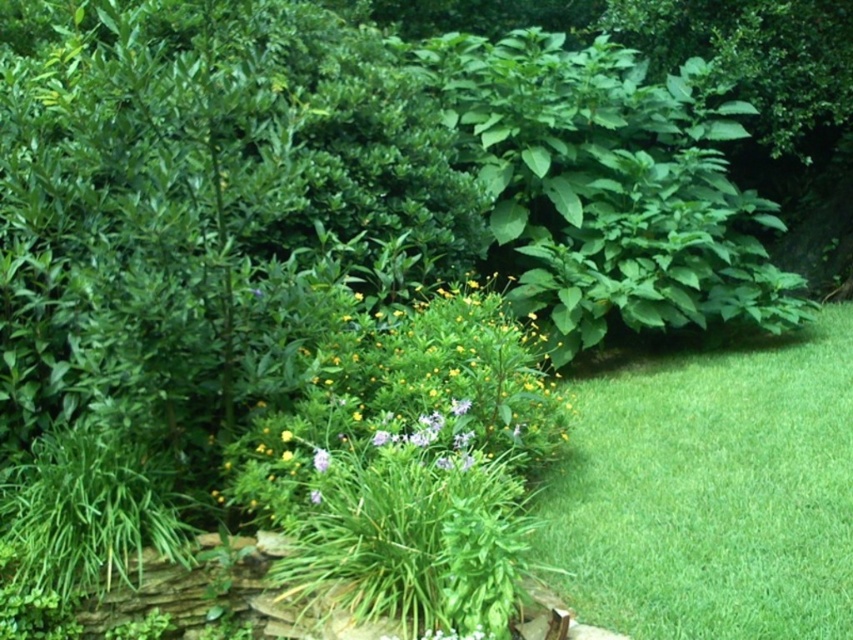
Question: Is green leafy plant at center wider than yellow matte flower at center?

Choices:
 (A) yes
 (B) no

Answer: (A)

Question: Can you confirm if green smooth grass at lower right is bigger than purple matte flower at center?

Choices:
 (A) yes
 (B) no

Answer: (A)

Question: Which point is closer to the camera?

Choices:
 (A) (280, 436)
 (B) (320, 448)

Answer: (B)

Question: Which point appears closest to the camera in this image?

Choices:
 (A) 283,433
 (B) 498,316

Answer: (A)

Question: Is green smooth grass at lower right to the left of yellow matte flower at center from the viewer's perspective?

Choices:
 (A) no
 (B) yes

Answer: (A)

Question: Which object appears farthest from the camera in this image?

Choices:
 (A) green smooth grass at lower right
 (B) purple matte flower at center
 (C) green leafy plant at center

Answer: (C)